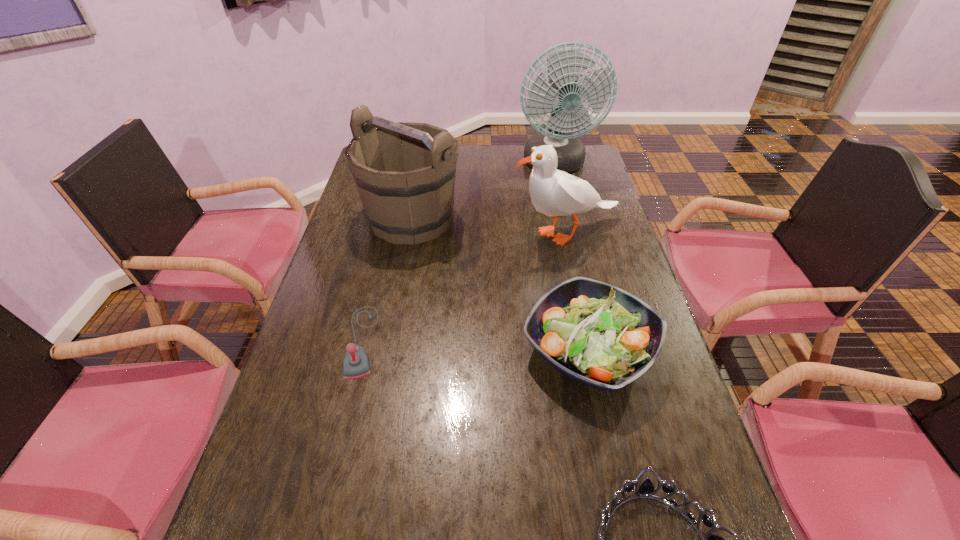
Where is `vacant space at the left edge`? This screenshot has height=540, width=960. vacant space at the left edge is located at coordinates (342, 238).

Find the location of a particular element. This screenshot has height=540, width=960. free space at the right edge of the desktop is located at coordinates (663, 421).

Identify the location of free space that is in between the bucket and the farthest object. (483, 192).

Locate an element on the screen. Image resolution: width=960 pixels, height=540 pixels. free space between the joystick and the bucket is located at coordinates (387, 280).

The image size is (960, 540). I want to click on free space between the gull and the bucket, so click(489, 226).

This screenshot has width=960, height=540. Identify the location of free space that is in between the tallest object and the salad plate. (572, 257).

Locate an element on the screen. unoccupied area between the salad plate and the bucket is located at coordinates (500, 284).

The height and width of the screenshot is (540, 960). I want to click on vacant area between the third shortest object and the bucket, so click(x=500, y=284).

At what (x,y) coordinates should I click in order to perform the action: click on free spot between the joystick and the gull. Please return your answer as a coordinate pair (x, y). Looking at the image, I should click on (464, 287).

You are a GUI agent. You are given a task and a screenshot of the screen. Output one action in this format:
    pyautogui.click(x=<x>, y=<y>)
    Task: Click on the free area in between the gull and the joystick
    
    Given the screenshot: What is the action you would take?
    pyautogui.click(x=464, y=287)